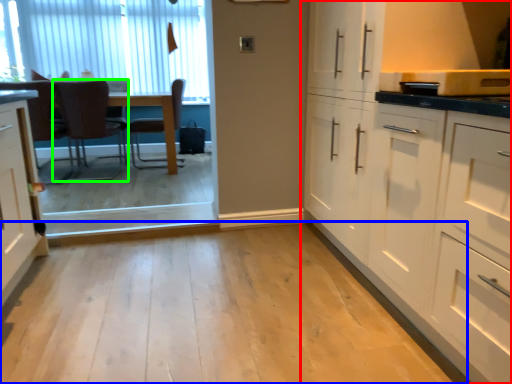
Question: Which object is positioned closest to cabinetry (highlighted by a red box)? Select from plain (highlighted by a blue box) and chair (highlighted by a green box).

Choices:
 (A) plain
 (B) chair

Answer: (A)